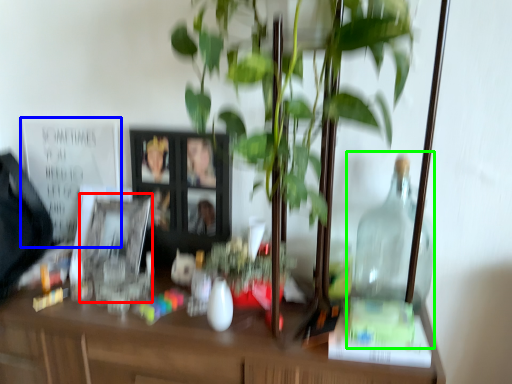
Question: Which is farther away from picture frame (highlighted by a red box)? bulletin board (highlighted by a blue box) or glass jar (highlighted by a green box)?

Choices:
 (A) bulletin board
 (B) glass jar

Answer: (B)